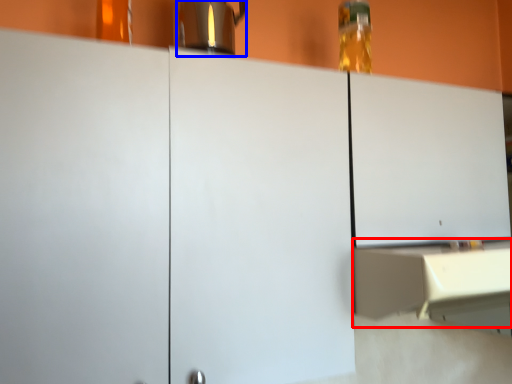
Question: Among these objects, which one is nearest to the camera, counter (highlighted by a red box) or coffeepot (highlighted by a blue box)?

Choices:
 (A) counter
 (B) coffeepot

Answer: (A)